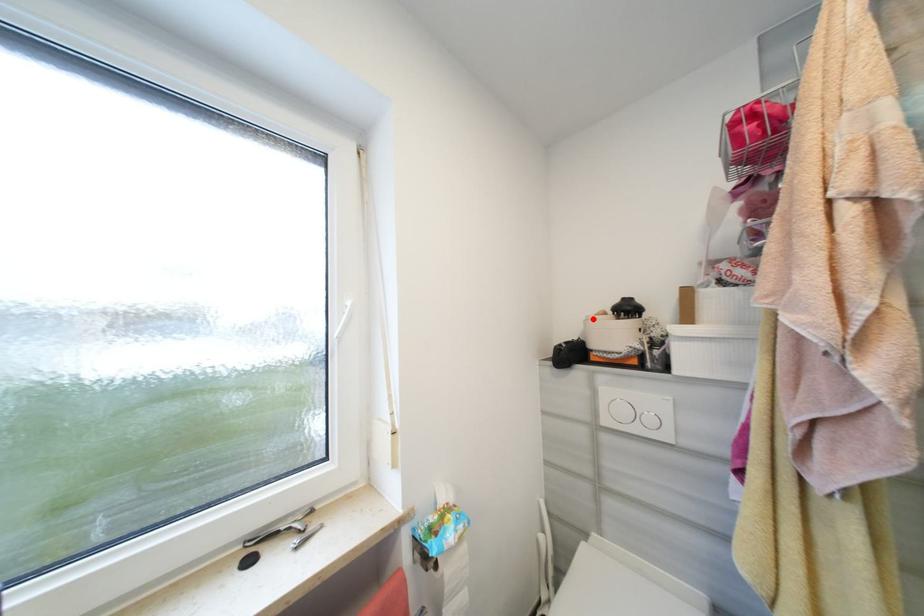
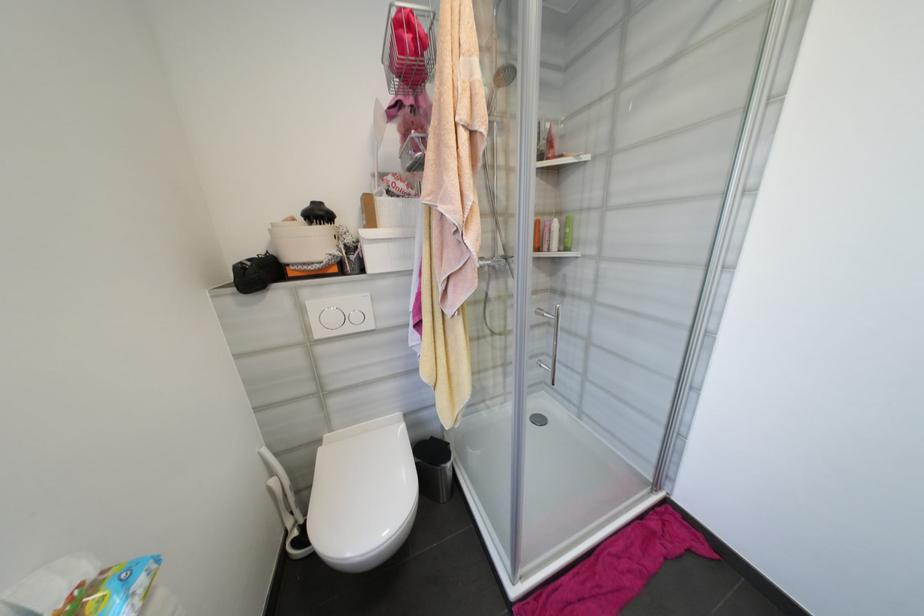
Question: I am providing you with two images of the same scene from different viewpoints. A red point is marked on the first image. Can you still see the location of the red point in image 2?

Choices:
 (A) Yes
 (B) No

Answer: (A)